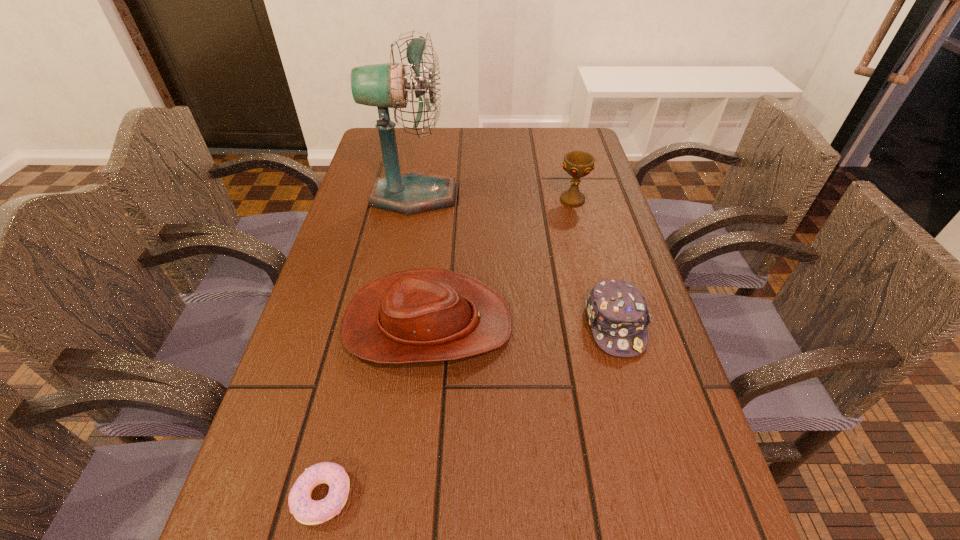
Identify the location of vacant space at the far right corner of the desktop. (586, 139).

Where is `free space between the third tallest object and the nearest object`? This screenshot has height=540, width=960. free space between the third tallest object and the nearest object is located at coordinates (375, 410).

Identify the location of vacant point located between the headwear and the nearest object. (468, 410).

This screenshot has width=960, height=540. Identify the location of free spot between the headwear and the fan. (515, 260).

I want to click on unoccupied area between the fan and the third shortest object, so click(x=420, y=260).

Where is `free space between the cowboy hat and the chalice`? Image resolution: width=960 pixels, height=540 pixels. free space between the cowboy hat and the chalice is located at coordinates (500, 261).

Image resolution: width=960 pixels, height=540 pixels. I want to click on vacant space that's between the fan and the second shortest object, so click(x=515, y=260).

You are a GUI agent. You are given a task and a screenshot of the screen. Output one action in this format:
    pyautogui.click(x=<x>, y=<y>)
    Task: Click on the free space between the tallest object and the third tallest object
    
    Given the screenshot: What is the action you would take?
    pyautogui.click(x=420, y=260)

The width and height of the screenshot is (960, 540). I want to click on free area in between the cowboy hat and the second shortest object, so click(521, 325).

Find the location of a particular element. object that stands as the second closest to the second shortest object is located at coordinates (577, 164).